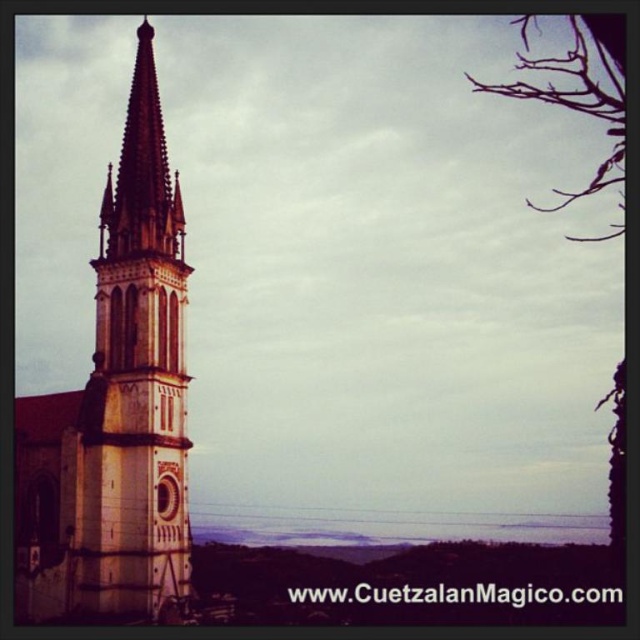
Does point (138, 449) come in front of point (531, 19)?

Yes, point (138, 449) is closer to viewer.

Does white stone church at left appear on the left side of brown/dry branches at upper right?

Correct, you'll find white stone church at left to the left of brown/dry branches at upper right.

The width and height of the screenshot is (640, 640). In order to click on white stone church at left in this screenshot , I will do `click(115, 406)`.

The height and width of the screenshot is (640, 640). I want to click on white stone church at left, so click(x=115, y=406).